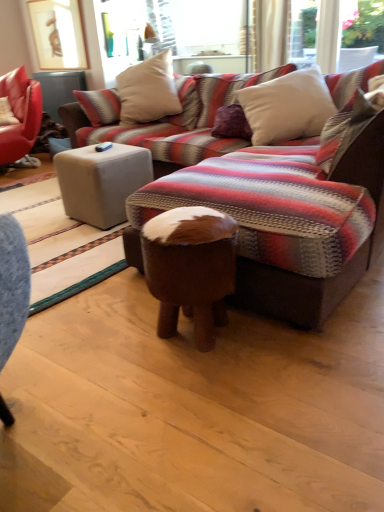
Find the location of `vacant space situated above beige fabric ottoman at center, acting as the 1th table starting from the front (from a real-world perspective)`. vacant space situated above beige fabric ottoman at center, acting as the 1th table starting from the front (from a real-world perspective) is located at coordinates (103, 147).